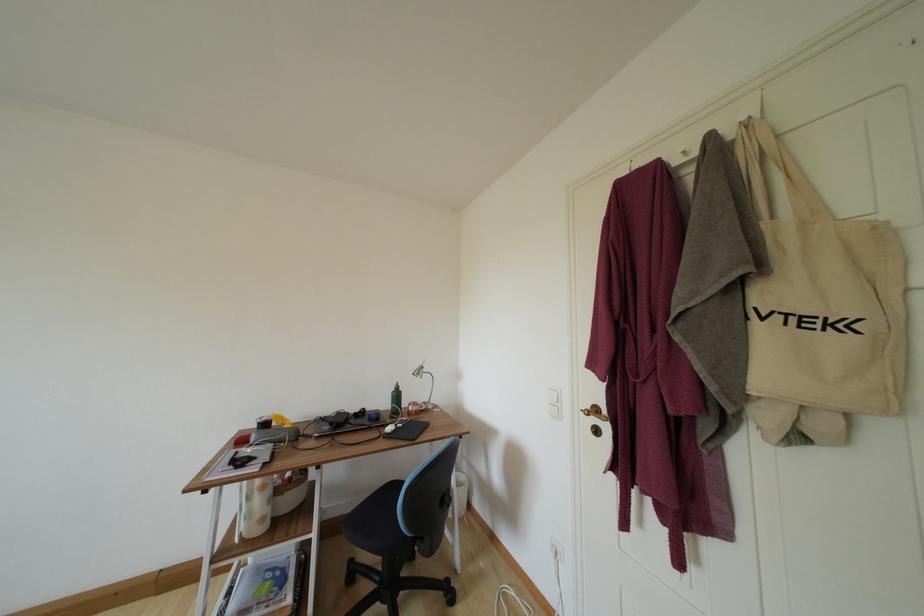
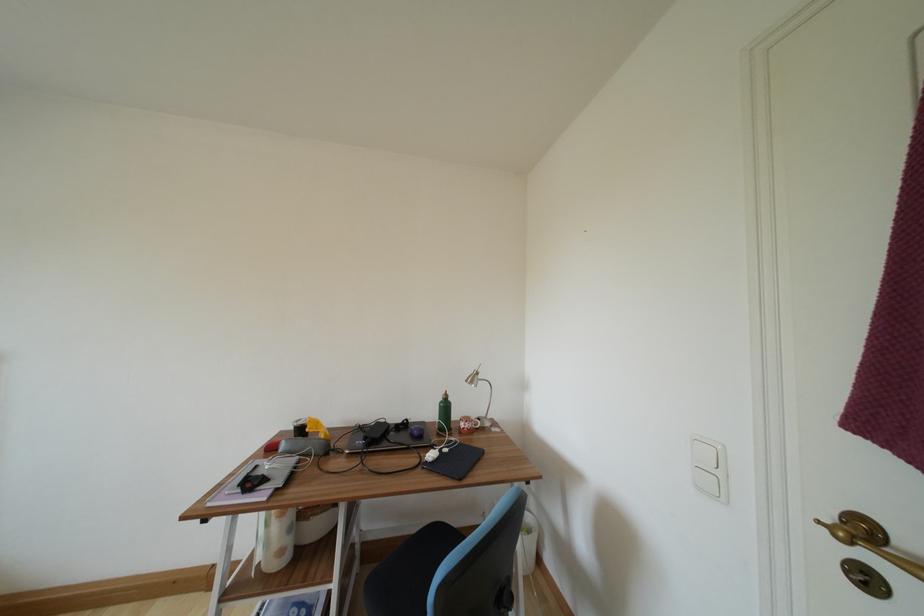
Question: In a continuous first-person perspective shot, in which direction is the camera moving?

Choices:
 (A) Left
 (B) Right
 (C) Forward
 (D) Backward

Answer: (C)